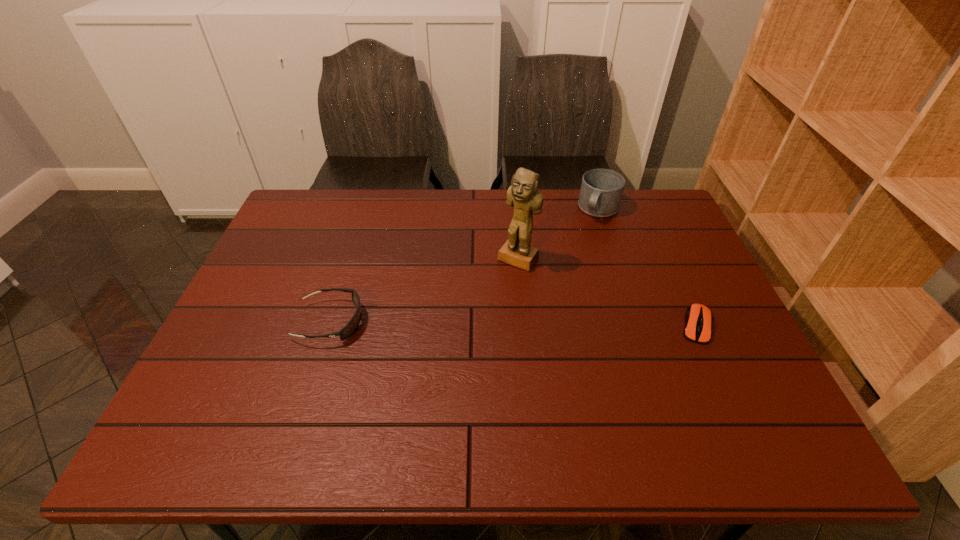
The height and width of the screenshot is (540, 960). What are the coordinates of `vacant space at the left edge of the desktop` in the screenshot? It's located at (276, 249).

This screenshot has height=540, width=960. What are the coordinates of `vacant area at the right edge` in the screenshot? It's located at pyautogui.click(x=719, y=345).

Image resolution: width=960 pixels, height=540 pixels. What are the coordinates of `free space at the far left corner of the desktop` in the screenshot? It's located at (294, 219).

What are the coordinates of `vacant space at the far right corner` in the screenshot? It's located at (654, 232).

The height and width of the screenshot is (540, 960). I want to click on free space between the second object from right to left and the leftmost object, so click(465, 266).

At what (x,y) coordinates should I click in order to perform the action: click on empty location between the leftmost object and the mug. Please return your answer as a coordinate pair (x, y). The height and width of the screenshot is (540, 960). Looking at the image, I should click on (465, 266).

I want to click on vacant region between the third object from right to left and the goggles, so click(424, 291).

The height and width of the screenshot is (540, 960). What are the coordinates of `empty space between the mug and the computer mouse` in the screenshot? It's located at (648, 268).

Find the location of a particular element. The height and width of the screenshot is (540, 960). free space between the second object from left to right and the second object from right to left is located at coordinates (559, 234).

Identify the location of free space that is in between the second object from right to left and the figurine. (559, 234).